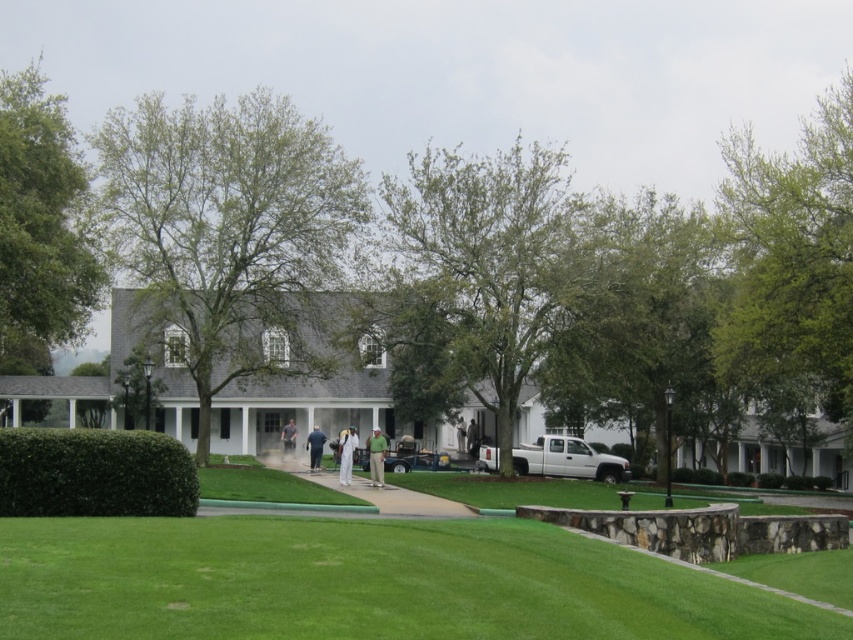
In the scene shown: Who is higher up, green matte shirt at center or light gray fabric jacket at center?

green matte shirt at center is higher up.

Is point (378, 454) positioned after point (294, 444)?

No, (378, 454) is in front of (294, 444).

What are the coordinates of `green matte shirt at center` in the screenshot? It's located at (376, 456).

Who is positioned more to the right, green grass at lower center or white matte suit at center?

green grass at lower center

You are a GUI agent. You are given a task and a screenshot of the screen. Output one action in this format:
    pyautogui.click(x=<x>, y=<y>)
    Task: Click on the green grass at lower center
    
    Given the screenshot: What is the action you would take?
    pyautogui.click(x=364, y=582)

I want to click on green grass at lower center, so click(x=364, y=582).

Between point (51, 444) and point (287, 454), which one is positioned in front?

Positioned in front is point (51, 444).

This screenshot has height=640, width=853. Describe the element at coordinates (94, 474) in the screenshot. I see `green leafy hedge at lower left` at that location.

Is point (181, 468) farther from camera compared to point (280, 435)?

No, (181, 468) is closer to viewer.

Find the location of a particular element. green leafy hedge at lower left is located at coordinates (94, 474).